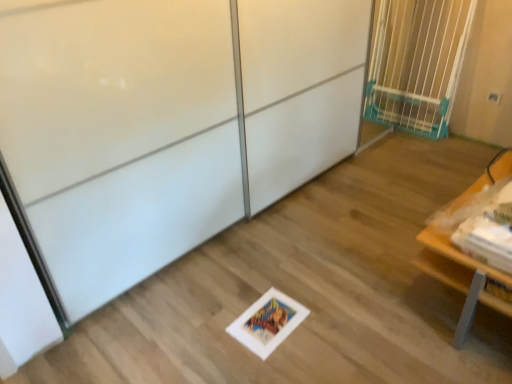
The width and height of the screenshot is (512, 384). Identify the location of blue plastic gate at upper right. (417, 63).

At what (x,y) coordinates should I click in order to perform the action: click on wooden table at lower right. Please return your answer as a coordinate pair (x, y). This screenshot has height=384, width=512. Looking at the image, I should click on (461, 277).

You are a GUI agent. You are given a task and a screenshot of the screen. Output one action in this format:
    pyautogui.click(x=<x>, y=<y>)
    Task: Click on the blue plastic gate at upper right
    
    Given the screenshot: What is the action you would take?
    pyautogui.click(x=417, y=63)

Which is more distant, (x=169, y=15) or (x=448, y=99)?

Point (x=448, y=99)

Which object is wider, white glossy screen door at center or blue plastic gate at upper right?

white glossy screen door at center.

Would you say white glossy screen door at center is to the left or to the right of blue plastic gate at upper right in the picture?

Based on their positions, white glossy screen door at center is located to the left of blue plastic gate at upper right.

Is white glossy screen door at center aimed at blue plastic gate at upper right?

Yes, white glossy screen door at center is facing blue plastic gate at upper right.

Can you confirm if blue plastic gate at upper right is positioned to the right of white glossy screen door at center?

Yes.

Measure the distance from blue plastic gate at upper right to white glossy screen door at center.

blue plastic gate at upper right and white glossy screen door at center are 1.43 meters apart.

Are blue plastic gate at upper right and white glossy screen door at center beside each other?

There is a gap between blue plastic gate at upper right and white glossy screen door at center.

Considering the sizes of objects blue plastic gate at upper right and white glossy screen door at center in the image provided, who is wider, blue plastic gate at upper right or white glossy screen door at center?

white glossy screen door at center.

How many degrees apart are the facing directions of blue plastic gate at upper right and wooden table at lower right?

There is a 91.8-degree angle between the facing directions of blue plastic gate at upper right and wooden table at lower right.

Could you tell me if blue plastic gate at upper right is facing wooden table at lower right?

No, blue plastic gate at upper right is not turned towards wooden table at lower right.

Is blue plastic gate at upper right far from wooden table at lower right?

Yes, blue plastic gate at upper right and wooden table at lower right are quite far apart.

Can you confirm if blue plastic gate at upper right is positioned to the right of wooden table at lower right?

Yes, blue plastic gate at upper right is to the right of wooden table at lower right.

Is white glossy screen door at center in front of or behind wooden table at lower right in the image?

In the image, white glossy screen door at center appears in front of wooden table at lower right.

Based on the photo, is white glossy screen door at center located outside wooden table at lower right?

white glossy screen door at center lies outside wooden table at lower right's area.

From a real-world perspective, is white glossy screen door at center located higher than wooden table at lower right?

Indeed, from a real-world perspective, white glossy screen door at center stands above wooden table at lower right.

From the picture: Visually, is white glossy screen door at center positioned to the left or to the right of wooden table at lower right?

white glossy screen door at center is positioned on wooden table at lower right's left side.

Looking at this image, who is bigger, wooden table at lower right or blue plastic gate at upper right?

With larger size is wooden table at lower right.

In terms of height, does wooden table at lower right look taller or shorter compared to blue plastic gate at upper right?

Clearly, wooden table at lower right is shorter compared to blue plastic gate at upper right.

Are wooden table at lower right and blue plastic gate at upper right beside each other?

There is a gap between wooden table at lower right and blue plastic gate at upper right.

The image size is (512, 384). In order to click on furniture that is under the white glossy screen door at center (from a real-world perspective) in this screenshot , I will do pyautogui.click(x=461, y=277).

From the image's perspective, would you say wooden table at lower right is shown under white glossy screen door at center?

Yes.

Is wooden table at lower right not inside white glossy screen door at center?

Indeed, wooden table at lower right is completely outside white glossy screen door at center.

How many degrees apart are the facing directions of wooden table at lower right and white glossy screen door at center?

180 degrees separate the facing orientations of wooden table at lower right and white glossy screen door at center.

Identify the location of screen door in front of the blue plastic gate at upper right. (168, 124).

Image resolution: width=512 pixels, height=384 pixels. In order to click on elevator lying above the white glossy screen door at center (from the image's perspective) in this screenshot , I will do click(x=417, y=63).

Estimate the real-world distances between objects in this image. Which object is closer to white glossy screen door at center, wooden table at lower right or blue plastic gate at upper right?

Based on the image, wooden table at lower right appears to be nearer to white glossy screen door at center.

Considering their positions, is blue plastic gate at upper right positioned closer to white glossy screen door at center than wooden table at lower right?

wooden table at lower right is closer to white glossy screen door at center.

Estimate the real-world distances between objects in this image. Which object is closer to blue plastic gate at upper right, white glossy screen door at center or wooden table at lower right?

→ Based on the image, wooden table at lower right appears to be nearer to blue plastic gate at upper right.

Estimate the real-world distances between objects in this image. Which object is closer to wooden table at lower right, white glossy screen door at center or blue plastic gate at upper right?

Based on the image, white glossy screen door at center appears to be nearer to wooden table at lower right.

Looking at this image, which object lies further to the anchor point wooden table at lower right, blue plastic gate at upper right or white glossy screen door at center?

blue plastic gate at upper right.

Considering their positions, is wooden table at lower right positioned further to blue plastic gate at upper right than white glossy screen door at center?

Based on the image, white glossy screen door at center appears to be further to blue plastic gate at upper right.

Where is `furniture located between white glossy screen door at center and blue plastic gate at upper right in the depth direction`? furniture located between white glossy screen door at center and blue plastic gate at upper right in the depth direction is located at coordinates (461, 277).